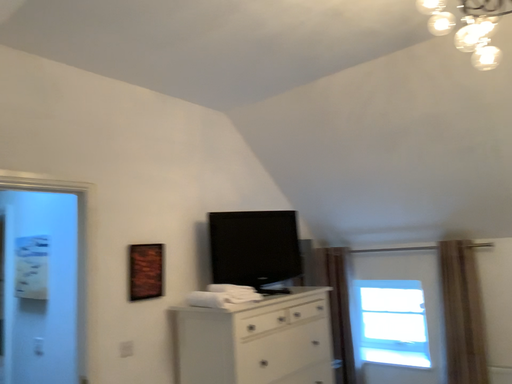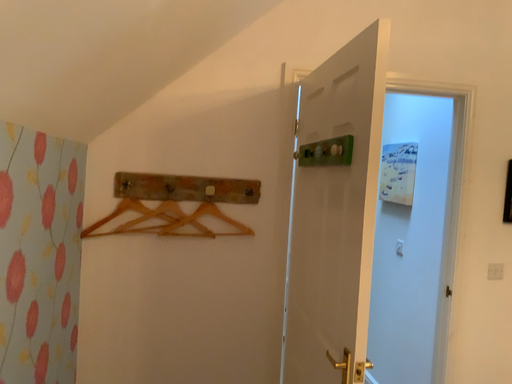
Question: How did the camera likely rotate when shooting the video?

Choices:
 (A) rotated left
 (B) rotated right

Answer: (A)